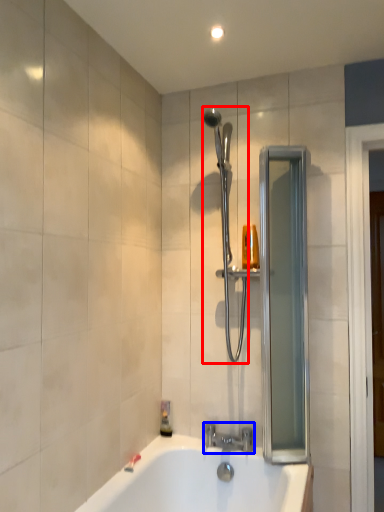
Question: Which point is closer to the camera, shower (highlighted by a red box) or tap (highlighted by a blue box)?

Choices:
 (A) shower
 (B) tap

Answer: (A)